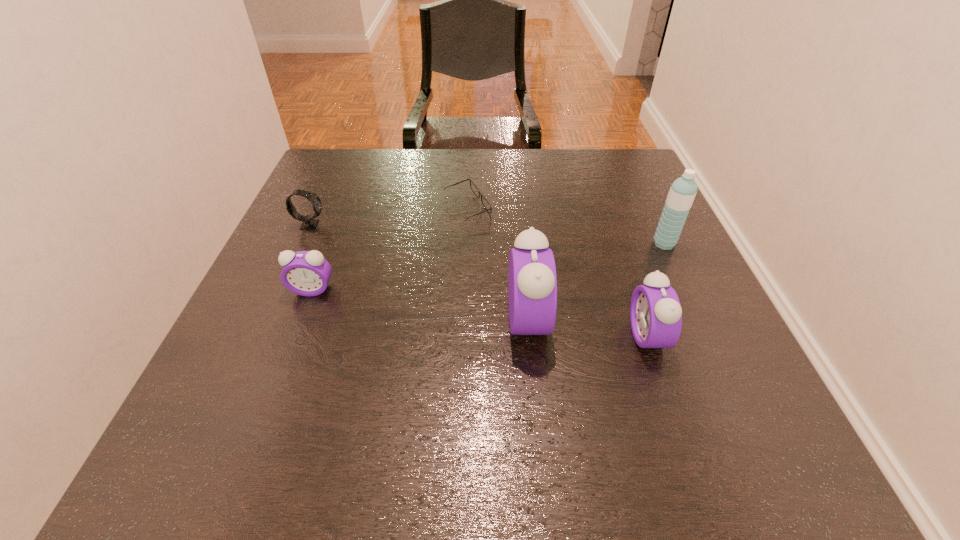
I want to click on vacant region located 0.070m on the face of the leftmost alarm clock, so click(300, 324).

Identify the location of free space located 0.070m on the face of the third object from right to left. This screenshot has width=960, height=540. (583, 320).

You are a GUI agent. You are given a task and a screenshot of the screen. Output one action in this format:
    pyautogui.click(x=<x>, y=<y>)
    Task: Click on the blank space located on the face of the second shortest alarm clock
    
    Given the screenshot: What is the action you would take?
    tap(562, 336)

Find the location of a particular element. vacant space located 0.180m on the face of the second shortest alarm clock is located at coordinates (535, 336).

You are a GUI agent. You are given a task and a screenshot of the screen. Output one action in this format:
    pyautogui.click(x=<x>, y=<y>)
    Task: Click on the vacant space located 0.400m on the face of the second shortest alarm clock
    The width and height of the screenshot is (960, 540).
    Given the screenshot: What is the action you would take?
    pyautogui.click(x=415, y=336)

Where is `free space located on the face of the watch`? This screenshot has width=960, height=540. free space located on the face of the watch is located at coordinates (414, 225).

At what (x,y) coordinates should I click in order to perform the action: click on vacant space positioned 0.190m with the lenses facing outward on the shortest object. Please return your answer as a coordinate pair (x, y). This screenshot has width=960, height=540. Looking at the image, I should click on (567, 208).

The image size is (960, 540). What are the coordinates of `vacant space located on the front of the third farthest object` in the screenshot? It's located at (679, 275).

This screenshot has height=540, width=960. I want to click on object at the far edge, so click(487, 206).

Identify the location of alarm clock positioned at the left edge. Image resolution: width=960 pixels, height=540 pixels. (307, 273).